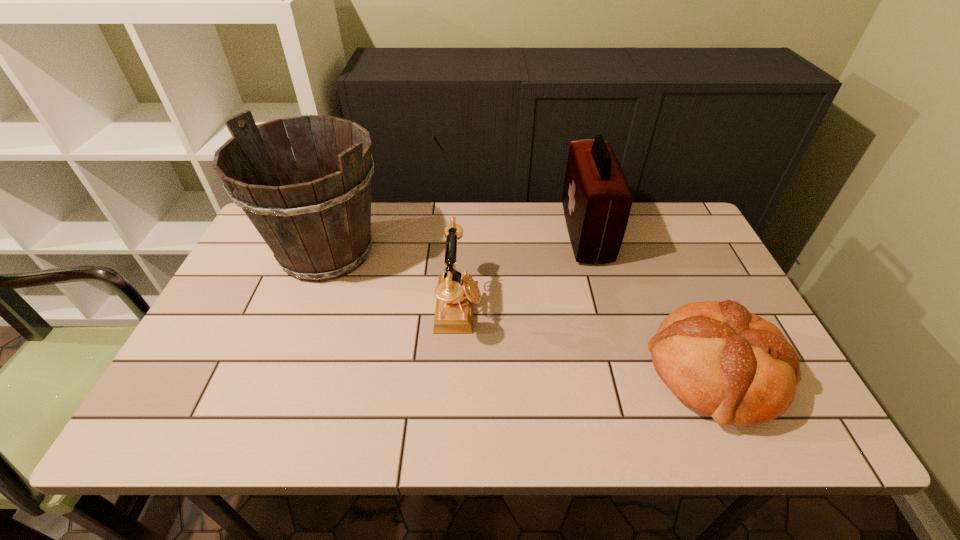
The image size is (960, 540). In the image, there is a desktop. What are the coordinates of `free space at the near edge` in the screenshot? It's located at (675, 421).

At what (x,y) coordinates should I click in order to perform the action: click on vacant position at the left edge of the desktop. Please return your answer as a coordinate pair (x, y). The width and height of the screenshot is (960, 540). Looking at the image, I should click on (209, 382).

What are the coordinates of `vacant region at the right edge` in the screenshot? It's located at (721, 278).

I want to click on vacant space at the near left corner of the desktop, so click(x=217, y=419).

Find the location of a particular element. The image size is (960, 540). vacant point located between the bread and the telephone is located at coordinates (587, 340).

Identify the location of vacant area that lies between the third object from right to left and the shortest object. (587, 340).

Where is `free point between the bread and the first aid kit`? free point between the bread and the first aid kit is located at coordinates (650, 303).

Locate an element on the screen. vacant area that lies between the third shortest object and the shortest object is located at coordinates (650, 303).

At what (x,y) coordinates should I click in order to perform the action: click on vacant space that is in between the first aid kit and the second object from left to right. Please return your answer as a coordinate pair (x, y). The width and height of the screenshot is (960, 540). Looking at the image, I should click on (522, 271).

Identify the location of unoccupied position between the third object from right to left and the bread. Image resolution: width=960 pixels, height=540 pixels. point(587,340).